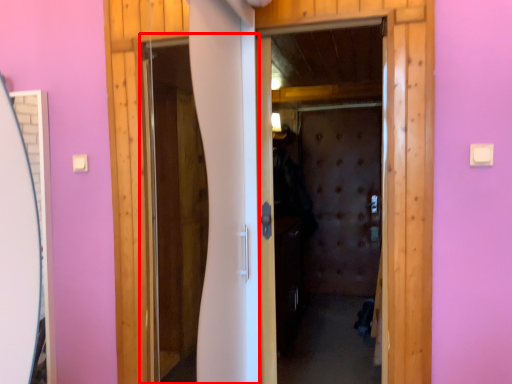
Question: From the image, what is the correct spatial relationship of screen door (annotated by the red box) in relation to screen door?

Choices:
 (A) right
 (B) left

Answer: (B)